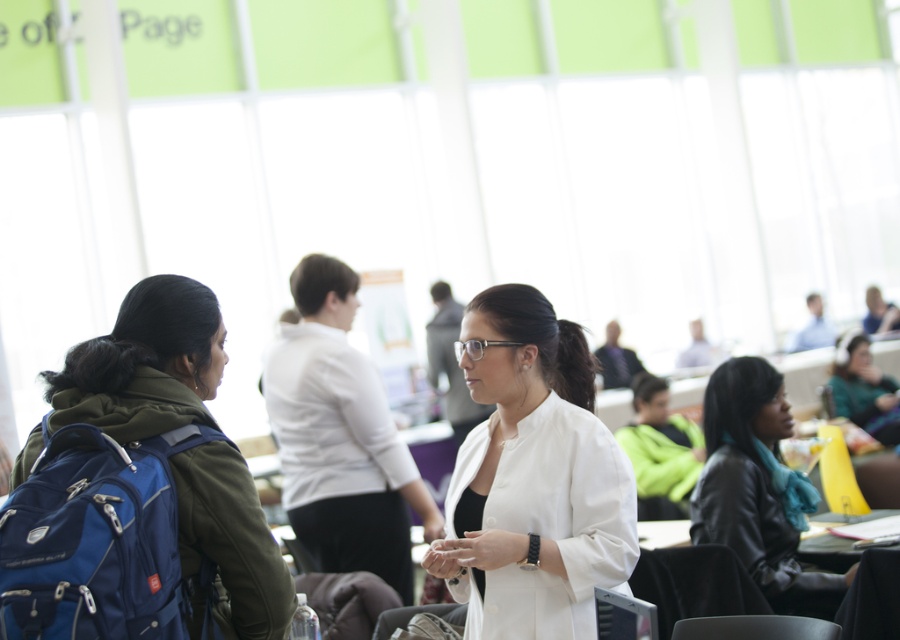
Does white matte blazer at center have a lesser width compared to black leather jacket at lower right?

Incorrect, white matte blazer at center's width is not less than black leather jacket at lower right's.

Is point (594, 512) closer to camera compared to point (745, 490)?

Yes, point (594, 512) is closer to viewer.

Where is `white matte blazer at center`? white matte blazer at center is located at coordinates (533, 477).

Can you confirm if black leather jacket at lower right is taller than matte green sweater at right?

Indeed, black leather jacket at lower right has a greater height compared to matte green sweater at right.

Who is positioned more to the left, black leather jacket at lower right or matte green sweater at right?

From the viewer's perspective, black leather jacket at lower right appears more on the left side.

Locate an element on the screen. The width and height of the screenshot is (900, 640). black leather jacket at lower right is located at coordinates (758, 490).

Where is `black leather jacket at lower right`? The image size is (900, 640). black leather jacket at lower right is located at coordinates (758, 490).

Can you confirm if matte blue backpack at left is bigger than black leather jacket at lower right?

No, matte blue backpack at left is not bigger than black leather jacket at lower right.

Is point (96, 417) less distant than point (835, 602)?

Yes, it is.

Locate an element on the screen. The image size is (900, 640). matte blue backpack at left is located at coordinates (145, 364).